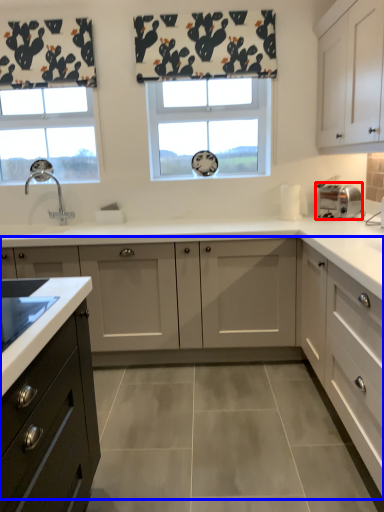
Question: Which point is further to the camera, toaster (highlighted by a red box) or cabinetry (highlighted by a blue box)?

Choices:
 (A) toaster
 (B) cabinetry

Answer: (A)